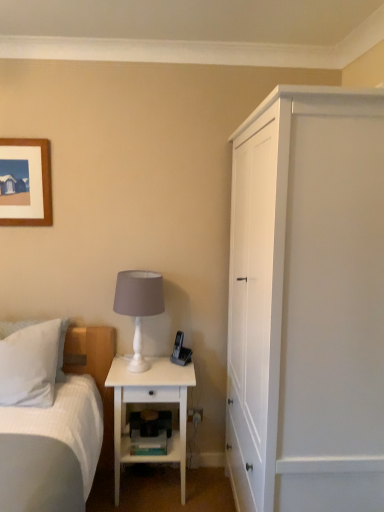
Question: Does white matte table lamp at center have a lesser height compared to white soft pillow at left?

Choices:
 (A) yes
 (B) no

Answer: (B)

Question: Does white matte table lamp at center have a larger size compared to white soft pillow at left?

Choices:
 (A) no
 (B) yes

Answer: (A)

Question: Is white matte table lamp at center wider than white soft pillow at left?

Choices:
 (A) no
 (B) yes

Answer: (A)

Question: Is white soft pillow at left completely or partially inside white matte table lamp at center?

Choices:
 (A) yes
 (B) no

Answer: (B)

Question: Is white matte table lamp at center at the left side of white soft pillow at left?

Choices:
 (A) yes
 (B) no

Answer: (B)

Question: In terms of size, does white matte nightstand at lower center appear bigger or smaller than white soft pillow at left?

Choices:
 (A) small
 (B) big

Answer: (B)

Question: Does point (162, 366) appear closer or farther from the camera than point (36, 364)?

Choices:
 (A) farther
 (B) closer

Answer: (A)

Question: Considering the positions of white matte nightstand at lower center and white soft pillow at left in the image, is white matte nightstand at lower center wider or thinner than white soft pillow at left?

Choices:
 (A) wide
 (B) thin

Answer: (A)

Question: From their relative heights in the image, would you say white matte nightstand at lower center is taller or shorter than white soft pillow at left?

Choices:
 (A) short
 (B) tall

Answer: (B)

Question: From a real-world perspective, is white soft pillow at left positioned above or below white matte nightstand at lower center?

Choices:
 (A) below
 (B) above

Answer: (B)

Question: Choose the correct answer: Is white soft pillow at left inside white matte nightstand at lower center or outside it?

Choices:
 (A) outside
 (B) inside

Answer: (A)

Question: Considering the positions of white soft pillow at left and white matte nightstand at lower center in the image, is white soft pillow at left wider or thinner than white matte nightstand at lower center?

Choices:
 (A) thin
 (B) wide

Answer: (A)

Question: Is point (1, 365) closer or farther from the camera than point (144, 387)?

Choices:
 (A) closer
 (B) farther

Answer: (A)

Question: From the image's perspective, is white matte nightstand at lower center above or below white matte table lamp at center?

Choices:
 (A) below
 (B) above

Answer: (A)

Question: Is white matte nightstand at lower center spatially inside white matte table lamp at center, or outside of it?

Choices:
 (A) inside
 (B) outside

Answer: (B)